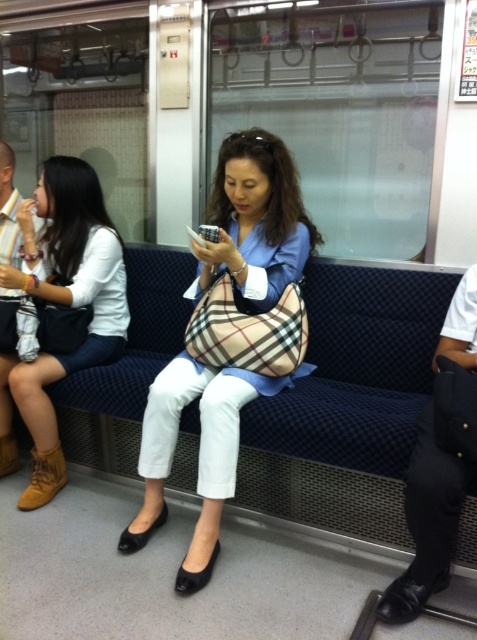
You are a photographer trying to capture a shot of the plaid fabric handbag at center and the brown leather coach at left. Since you want to ensure both items are clearly visible in the frame, which object should you focus on to account for their size difference?

The plaid fabric handbag at center is larger in width than the brown leather coach at left, so focusing on the plaid fabric handbag at center would ensure both are visible as it takes up more space.

You are a fashion designer observing the subway scene. You notice the plaid fabric handbag at center and the matte white blouse at upper left. Which item would you say is smaller in size?

The plaid fabric handbag at center is smaller than the matte white blouse at upper left.

You are a photographer standing in the subway car and want to take a photo of the matte white blouse at upper left and the brown leather coach at left. Since you can only focus on one object at a time, which one should you focus on to ensure it appears clearer in the photo?

The matte white blouse at upper left is in front of the brown leather coach at left, so focusing on the matte white blouse at upper left will ensure it appears clearer in the photo.